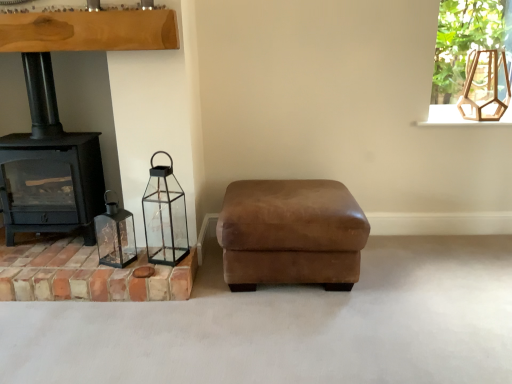
Question: Is terracotta brick at lower left smaller than wooden hexagonal lantern at upper right?

Choices:
 (A) yes
 (B) no

Answer: (B)

Question: Is wooden hexagonal lantern at upper right a part of terracotta brick at lower left?

Choices:
 (A) no
 (B) yes

Answer: (A)

Question: Can you confirm if terracotta brick at lower left is bigger than wooden hexagonal lantern at upper right?

Choices:
 (A) no
 (B) yes

Answer: (B)

Question: Is there a large distance between terracotta brick at lower left and wooden hexagonal lantern at upper right?

Choices:
 (A) yes
 (B) no

Answer: (A)

Question: From the image's perspective, is terracotta brick at lower left above wooden hexagonal lantern at upper right?

Choices:
 (A) yes
 (B) no

Answer: (B)

Question: In the image, is clear glass frame at upper right positioned in front of or behind black cast iron wood burning stove at left?

Choices:
 (A) front
 (B) behind

Answer: (B)

Question: Looking at the image, does clear glass frame at upper right seem bigger or smaller compared to black cast iron wood burning stove at left?

Choices:
 (A) small
 (B) big

Answer: (A)

Question: From the image's perspective, is clear glass frame at upper right located above or below black cast iron wood burning stove at left?

Choices:
 (A) below
 (B) above

Answer: (B)

Question: Is clear glass frame at upper right wider or thinner than black cast iron wood burning stove at left?

Choices:
 (A) thin
 (B) wide

Answer: (A)

Question: Looking at the image, does black glass lantern at lower left, positioned as the 2th candle holder in left-to-right order, seem bigger or smaller compared to matte glass lantern at left, arranged as the second candle holder when viewed from the right?

Choices:
 (A) small
 (B) big

Answer: (B)

Question: Is black glass lantern at lower left, positioned as the 2th candle holder in left-to-right order, inside the boundaries of matte glass lantern at left, the 1th candle holder when ordered from left to right, or outside?

Choices:
 (A) inside
 (B) outside

Answer: (B)

Question: From a real-world perspective, relative to matte glass lantern at left, arranged as the second candle holder when viewed from the right, is black glass lantern at lower left, positioned as the 2th candle holder in left-to-right order, vertically above or below?

Choices:
 (A) above
 (B) below

Answer: (A)

Question: Considering the positions of black glass lantern at lower left, positioned as the 2th candle holder in left-to-right order, and matte glass lantern at left, arranged as the second candle holder when viewed from the right, in the image, is black glass lantern at lower left, positioned as the 2th candle holder in left-to-right order, wider or thinner than matte glass lantern at left, arranged as the second candle holder when viewed from the right,?

Choices:
 (A) thin
 (B) wide

Answer: (B)

Question: In terms of height, does clear glass frame at upper right look taller or shorter compared to matte glass lantern at left, the 1th candle holder when ordered from left to right?

Choices:
 (A) tall
 (B) short

Answer: (A)

Question: Considering the positions of clear glass frame at upper right and matte glass lantern at left, the 1th candle holder when ordered from left to right, in the image, is clear glass frame at upper right bigger or smaller than matte glass lantern at left, the 1th candle holder when ordered from left to right,?

Choices:
 (A) big
 (B) small

Answer: (A)